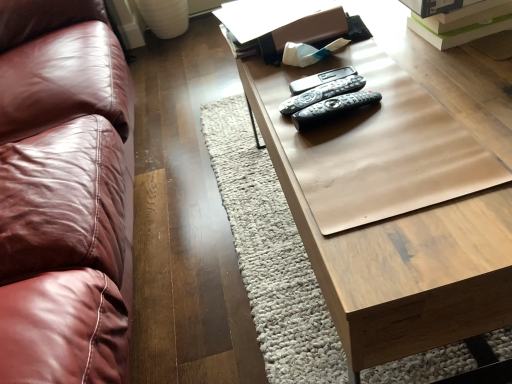
You are a GUI agent. You are given a task and a screenshot of the screen. Output one action in this format:
    pyautogui.click(x=<x>, y=<y>)
    Task: Click on the free location to the right of black plastic remotes at center, acting as the third remote starting from the back
    Image resolution: width=512 pixels, height=384 pixels.
    Given the screenshot: What is the action you would take?
    pyautogui.click(x=426, y=98)